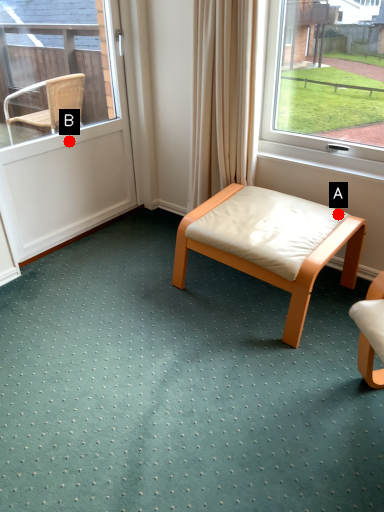
Question: Two points are circled on the image, labeled by A and B beside each circle. Which point is closer to the camera?

Choices:
 (A) A is closer
 (B) B is closer

Answer: (A)